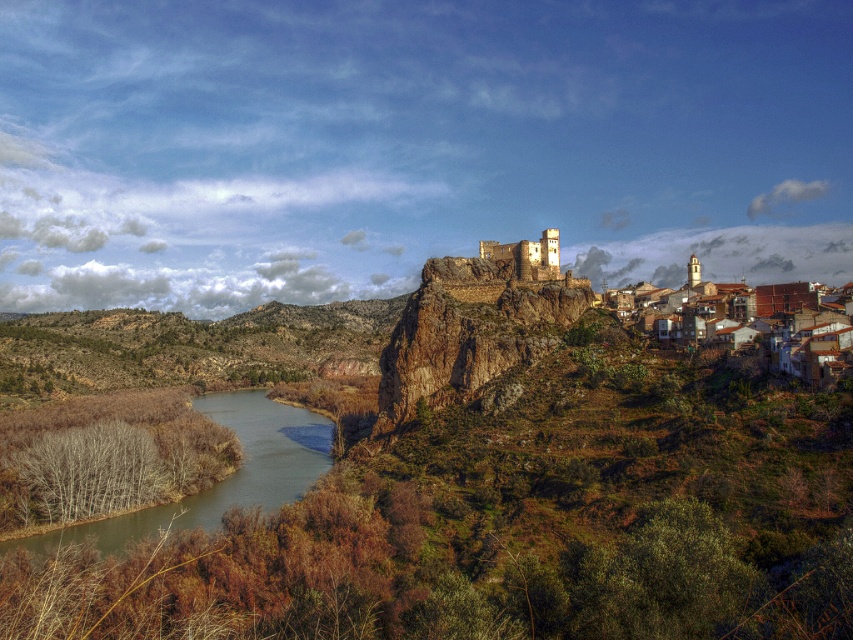
In the scene shown: You are standing at the base of the rocky hilltop and looking towards the river. There is a point marked at coordinates (x=764, y=324) which indicates the location of brown clay houses at lower right. Can you see the brown clay houses at lower right from your current position?

Yes, the point marked at (x=764, y=324) indicates that the brown clay houses at lower right are visible from your current position at the base of the rocky hilltop.